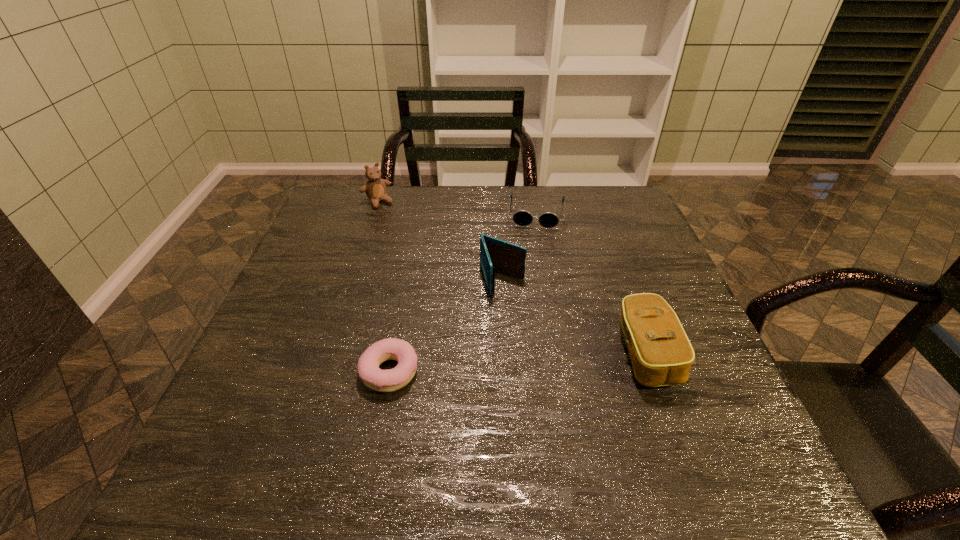
At what (x,y) coordinates should I click in order to perform the action: click on free point that satisfies the following two spatial constraints: 1. on the front side of the teddy bear; 2. on the zipper side of the clutch bag. Please return your answer as a coordinate pair (x, y). The image size is (960, 540). Looking at the image, I should click on (328, 353).